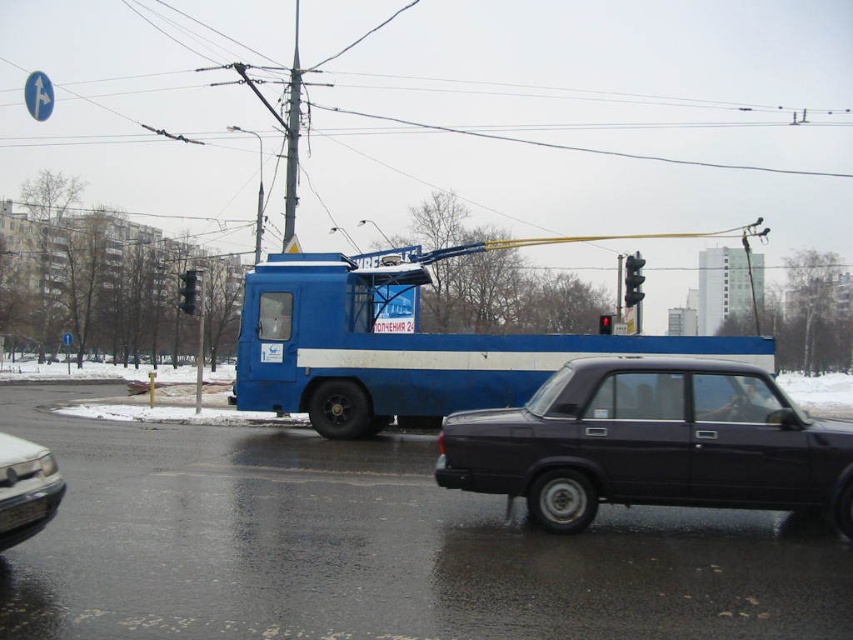
Does point (299, 276) come behind point (190, 298)?

No, (299, 276) is closer to viewer.

Does blue matte truck at center come behind black glass traffic light at upper center?

No, it is in front of black glass traffic light at upper center.

Which is behind, point (381, 296) or point (193, 292)?

Positioned behind is point (193, 292).

Where is `blue matte truck at center`? This screenshot has height=640, width=853. blue matte truck at center is located at coordinates (405, 342).

Between shiny black sedan at center and shiny silver car at lower left, which one has less height?

shiny silver car at lower left

Is shiny black sedan at center shorter than shiny silver car at lower left?

Incorrect, shiny black sedan at center's height does not fall short of shiny silver car at lower left's.

Between point (738, 436) and point (4, 541), which one is positioned in front?

Positioned in front is point (4, 541).

Locate an element on the screen. This screenshot has height=640, width=853. shiny black sedan at center is located at coordinates (651, 444).

Does shiny silver car at lower left have a smaller size compared to black glass traffic light at right?

Indeed, shiny silver car at lower left has a smaller size compared to black glass traffic light at right.

Which is behind, point (33, 516) or point (631, 289)?

Positioned behind is point (631, 289).

You are a GUI agent. You are given a task and a screenshot of the screen. Output one action in this format:
    pyautogui.click(x=<x>, y=<y>)
    Task: Click on the shiny silver car at lower left
    The height and width of the screenshot is (640, 853).
    Given the screenshot: What is the action you would take?
    pyautogui.click(x=26, y=488)